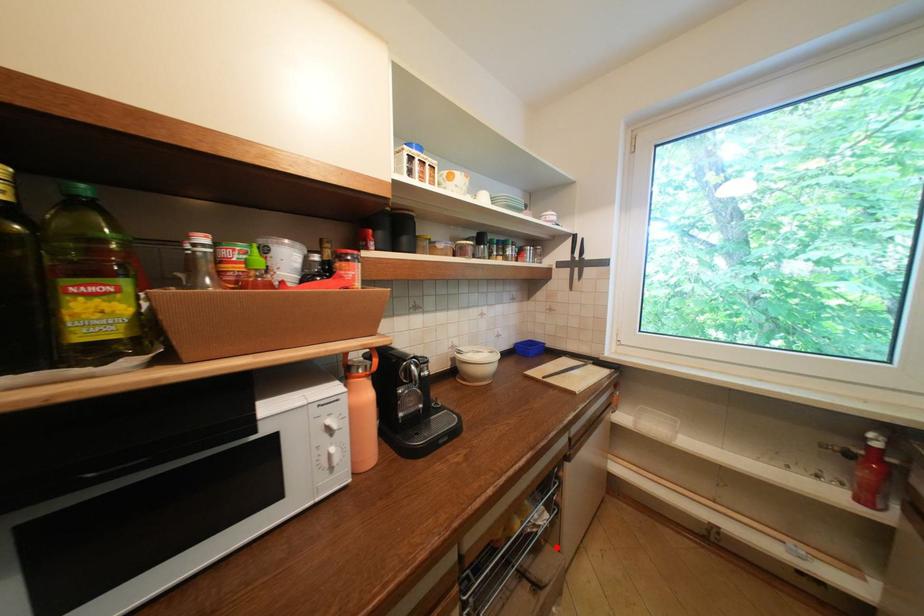
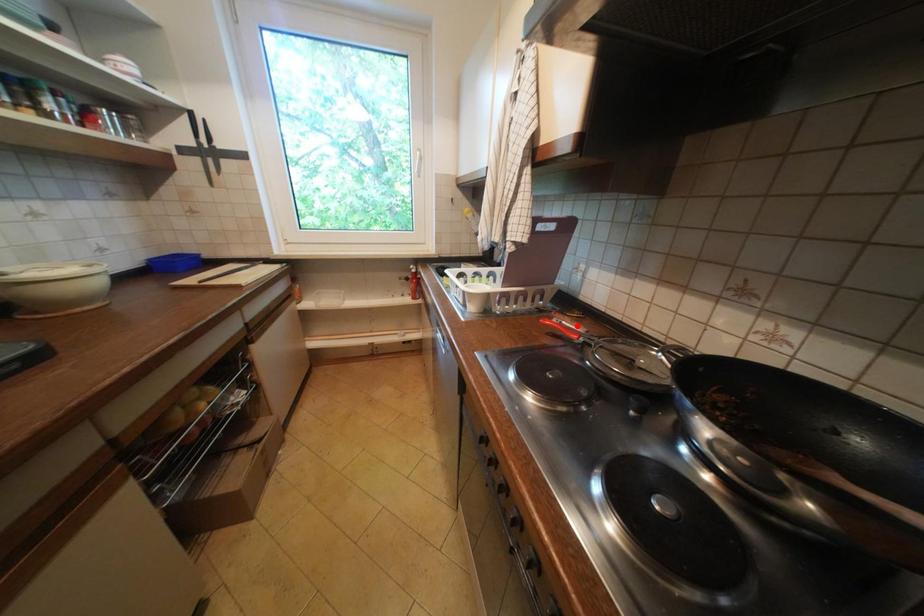
I am providing you with two images of the same scene from different viewpoints. A red point is marked on the first image and another point is marked on the second image. Is the red point in image1 aligned with the point shown in image2?

No